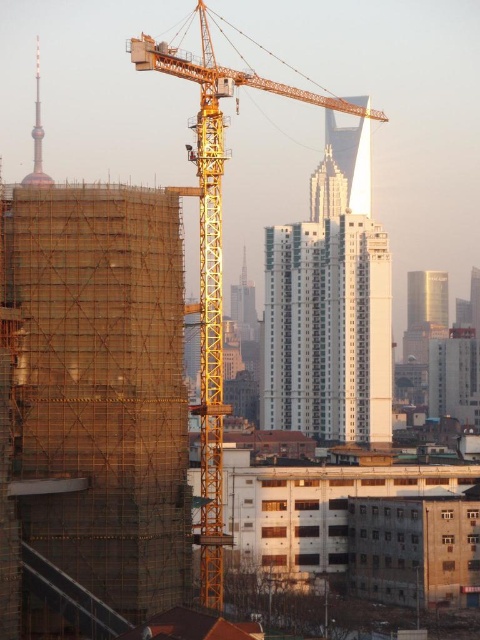
You are a construction worker needing to move a heavy beam from the yellow metallic crane at center to the shiny gold tower at upper left. The beam is 100 meters long. Can you safely transport it without bending or breaking the beam?

Result: The distance between the yellow metallic crane at center and the shiny gold tower at upper left is 96.45 meters. Since the beam is 100 meters long, it is longer than the required distance. Therefore, the beam can be safely transported without bending or breaking as there is enough length to span the gap.

From the picture: You are a construction worker standing at the base of the yellow metallic crane at center and the gold reflective tower at right. You need to determine which structure you can see the top of first when looking upward. Which one will you see the top of first?

The yellow metallic crane at center is taller than the gold reflective tower at right, so you will see the top of the yellow metallic crane at center first when looking upward.

You are a drone operator tasked with capturing aerial footage of the white smooth building at center. The drone has a maximum operational range of 600 meters. Can the drone safely capture footage from its current position without exceeding its operational limit?

The distance between the white smooth building at center and the camera is 646.92 meters. Since the drone has a maximum operational range of 600 meters, it cannot safely capture footage without exceeding its limit. The operator should move closer to the building or use a different drone with a longer range.